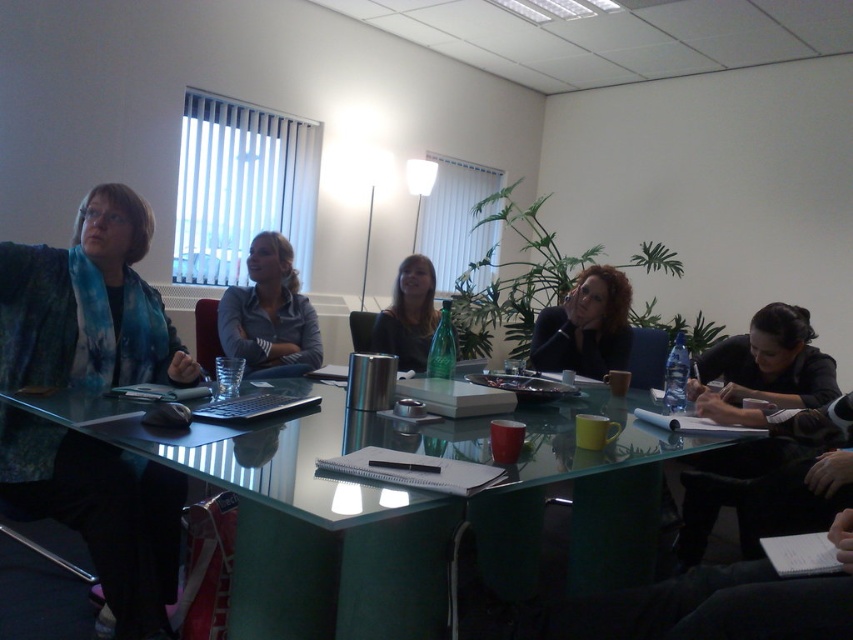
Is blue tie-dye scarf at left positioned before matte black hair at center?

Yes.

Which is above, blue tie-dye scarf at left or matte black hair at center?

matte black hair at center is higher up.

Does point (102, 268) come behind point (408, 275)?

No, it is not.

Identify the location of blue tie-dye scarf at left. (88, 305).

What do you see at coordinates (331, 524) in the screenshot? I see `transparent glass table at center` at bounding box center [331, 524].

The height and width of the screenshot is (640, 853). In order to click on transparent glass table at center in this screenshot , I will do `click(331, 524)`.

Is matte blue shirt at center behind dark brown hair at center?

That is False.

Is point (254, 333) positioned in front of point (566, 369)?

No.

Locate an element on the screen. matte blue shirt at center is located at coordinates (270, 314).

In order to click on matte blue shirt at center in this screenshot , I will do `click(270, 314)`.